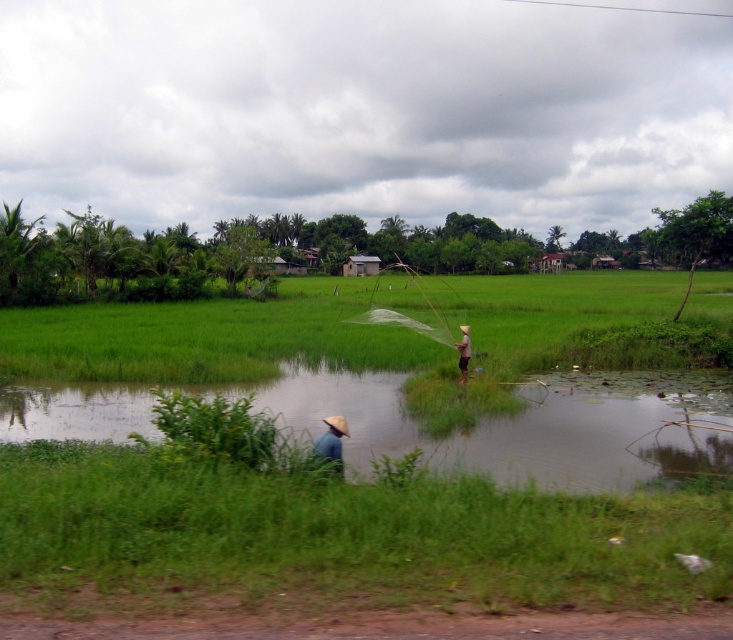
Question: Does green grass field at center have a lesser width compared to brown straw hat at lower center?

Choices:
 (A) yes
 (B) no

Answer: (B)

Question: Can you confirm if green grass field at center is smaller than green grassy water at lower center?

Choices:
 (A) yes
 (B) no

Answer: (B)

Question: Which point is farther to the camera?

Choices:
 (A) (26, 435)
 (B) (463, 372)
 (C) (336, 428)
 (D) (132, 365)

Answer: (D)

Question: Which is farther from the green grass field at center?

Choices:
 (A) light brown straw hat at center
 (B) brown straw hat at lower center

Answer: (B)

Question: Which point is farther from the camera taking this photo?

Choices:
 (A) pos(647,298)
 (B) pos(342,429)
 (C) pos(457,365)

Answer: (A)

Question: Can you confirm if green grassy water at lower center is positioned to the left of brown straw hat at lower center?

Choices:
 (A) yes
 (B) no

Answer: (B)